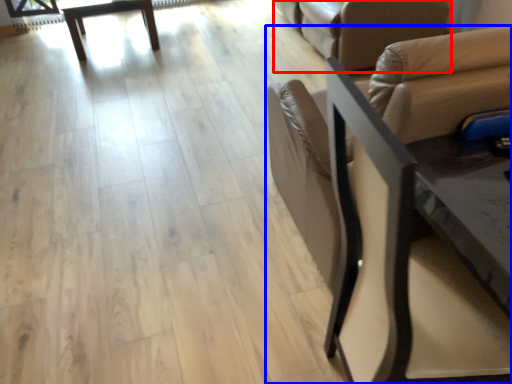
Question: Which point is further to the camera, futon (highlighted by a red box) or chair (highlighted by a blue box)?

Choices:
 (A) futon
 (B) chair

Answer: (A)